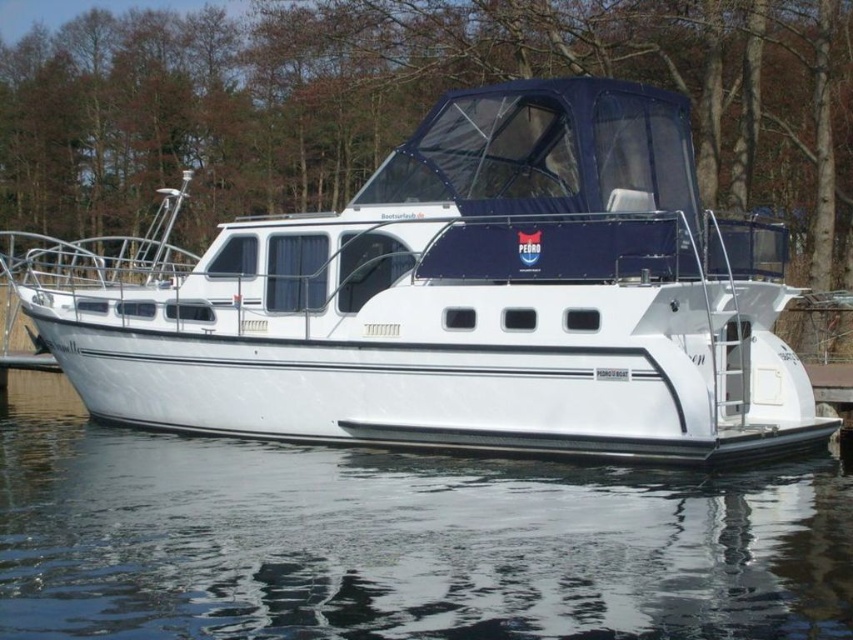
You are standing on the dock and see the white glossy boat at center and the transparent water at lower center. Which object is located more to the left?

The white glossy boat at center is positioned on the left side of transparent water at lower center, so it is more to the left.